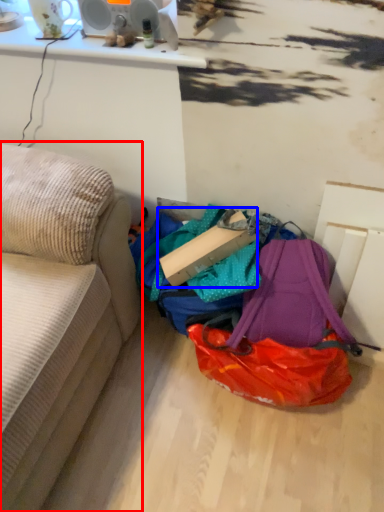
Question: Which point is further to the camera, studio couch (highlighted by a red box) or cardboard box (highlighted by a blue box)?

Choices:
 (A) studio couch
 (B) cardboard box

Answer: (B)